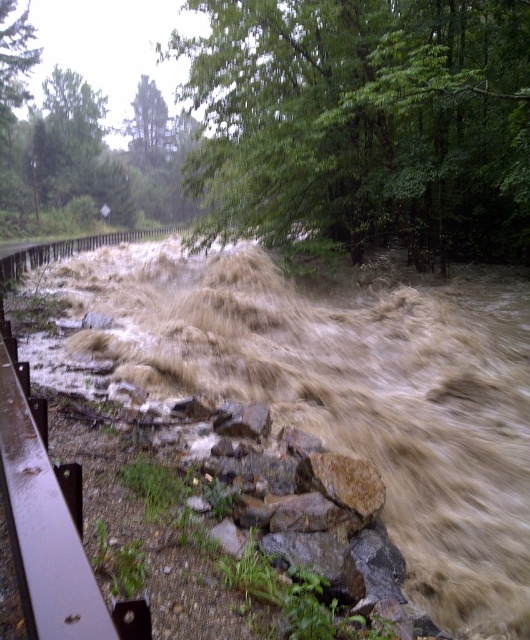
You are standing on a bridge overlooking the flooded area. You see a green leafy tree at upper center and a rusty metal rail at lower left. Which object is closer to you?

The green leafy tree at upper center is closer to you because it is in front of the rusty metal rail at lower left.

You are standing on a bridge and notice the brown muddy water at center. Based on its position, can you determine if it is flowing towards the bridge or away from it?

The brown muddy water at center is located at point coordinates, but without additional information about the direction of flow or reference points, it is impossible to determine whether it is flowing towards or away from the bridge.